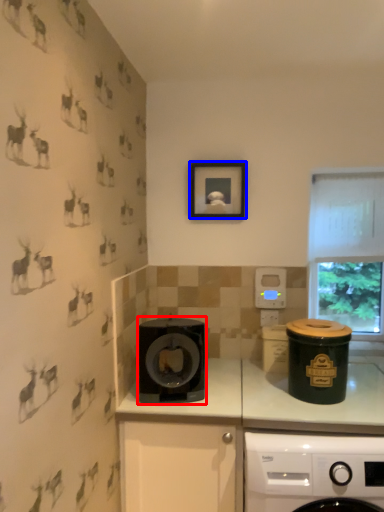
Question: Which point is further to the camera, kitchen appliance (highlighted by a red box) or picture frame (highlighted by a blue box)?

Choices:
 (A) kitchen appliance
 (B) picture frame

Answer: (B)